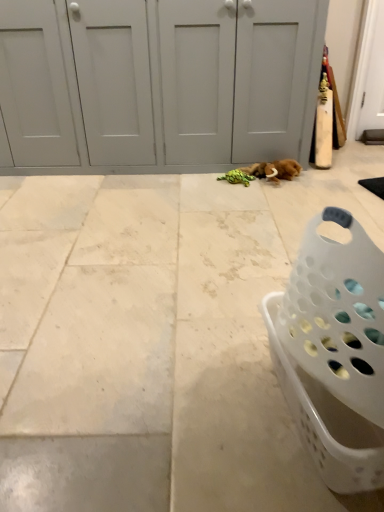
Question: Is white matte door at center bigger than white tile floor at center?

Choices:
 (A) no
 (B) yes

Answer: (B)

Question: Can you confirm if white matte door at center is wider than white tile floor at center?

Choices:
 (A) no
 (B) yes

Answer: (A)

Question: From a real-world perspective, is white matte door at center beneath white tile floor at center?

Choices:
 (A) no
 (B) yes

Answer: (A)

Question: Considering the relative sizes of white matte door at center and white tile floor at center in the image provided, is white matte door at center thinner than white tile floor at center?

Choices:
 (A) yes
 (B) no

Answer: (A)

Question: From the image's perspective, is white matte door at center below white tile floor at center?

Choices:
 (A) yes
 (B) no

Answer: (B)

Question: Is white matte door at center in front of or behind white tile floor at center in the image?

Choices:
 (A) behind
 (B) front

Answer: (A)

Question: Is white matte door at center situated inside white tile floor at center or outside?

Choices:
 (A) inside
 (B) outside

Answer: (B)

Question: From a real-world perspective, is white matte door at center physically located above or below white tile floor at center?

Choices:
 (A) above
 (B) below

Answer: (A)

Question: Is white matte door at center bigger or smaller than white tile floor at center?

Choices:
 (A) small
 (B) big

Answer: (B)

Question: In the image, is white matte door at center on the left side or the right side of white plastic laundry basket at lower right?

Choices:
 (A) left
 (B) right

Answer: (A)

Question: Choose the correct answer: Is white matte door at center inside white plastic laundry basket at lower right or outside it?

Choices:
 (A) outside
 (B) inside

Answer: (A)

Question: From a real-world perspective, is white matte door at center above or below white plastic laundry basket at lower right?

Choices:
 (A) above
 (B) below

Answer: (A)

Question: Considering their positions, is white matte door at center located in front of or behind white plastic laundry basket at lower right?

Choices:
 (A) front
 (B) behind

Answer: (B)

Question: From the image's perspective, is white plastic laundry basket at lower right above or below white tile floor at center?

Choices:
 (A) below
 (B) above

Answer: (A)

Question: Based on their positions, is white plastic laundry basket at lower right located to the left or right of white tile floor at center?

Choices:
 (A) left
 (B) right

Answer: (B)